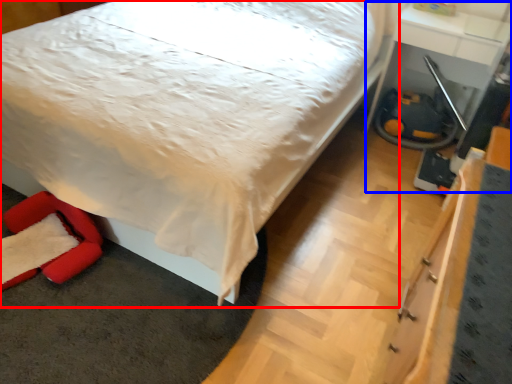
Question: Which object is further to the camera taking this photo, bed (highlighted by a red box) or table (highlighted by a blue box)?

Choices:
 (A) bed
 (B) table

Answer: (B)